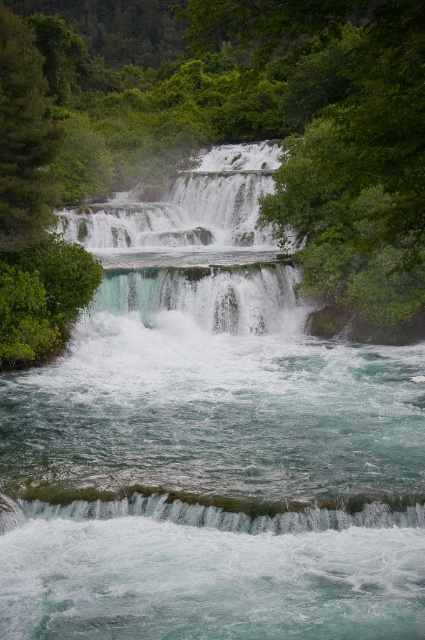
Is green leafy tree at center to the right of white frothy water at center from the viewer's perspective?

→ Incorrect, green leafy tree at center is not on the right side of white frothy water at center.

Who is positioned more to the right, green leafy tree at center or white frothy water at center?

white frothy water at center is more to the right.

At what (x,y) coordinates should I click in order to perform the action: click on green leafy tree at center. Please return your answer as a coordinate pair (x, y). Looking at the image, I should click on (246, 131).

Can you confirm if white frothy water at center is wider than translucent glass waterfall at lower center?

Correct, the width of white frothy water at center exceeds that of translucent glass waterfall at lower center.

Which is more to the left, white frothy water at center or translucent glass waterfall at lower center?

Positioned to the left is white frothy water at center.

Locate an element on the screen. The width and height of the screenshot is (425, 640). white frothy water at center is located at coordinates (197, 248).

Looking at this image, is green leafy tree at center wider than translucent glass waterfall at lower center?

Correct, the width of green leafy tree at center exceeds that of translucent glass waterfall at lower center.

Describe the element at coordinates (246, 131) in the screenshot. I see `green leafy tree at center` at that location.

Find the location of `green leafy tree at center`. green leafy tree at center is located at coordinates (246, 131).